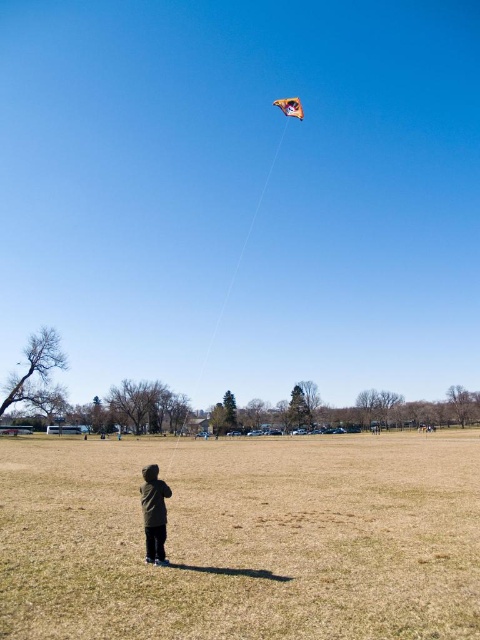
You are a photographer trying to capture the child in the scene. Since the dark green jacket at center and the orange fabric kite at upper center are both in view, which one appears larger in the photo?

The orange fabric kite at upper center appears larger in the photo because it is bigger than the dark green jacket at center.

You are a bird flying over the scene. From your perspective, which object is positioned to the left of the other between the brown grass at center and the orange fabric kite at upper center?

The brown grass at center is positioned to the left of the orange fabric kite at upper center.